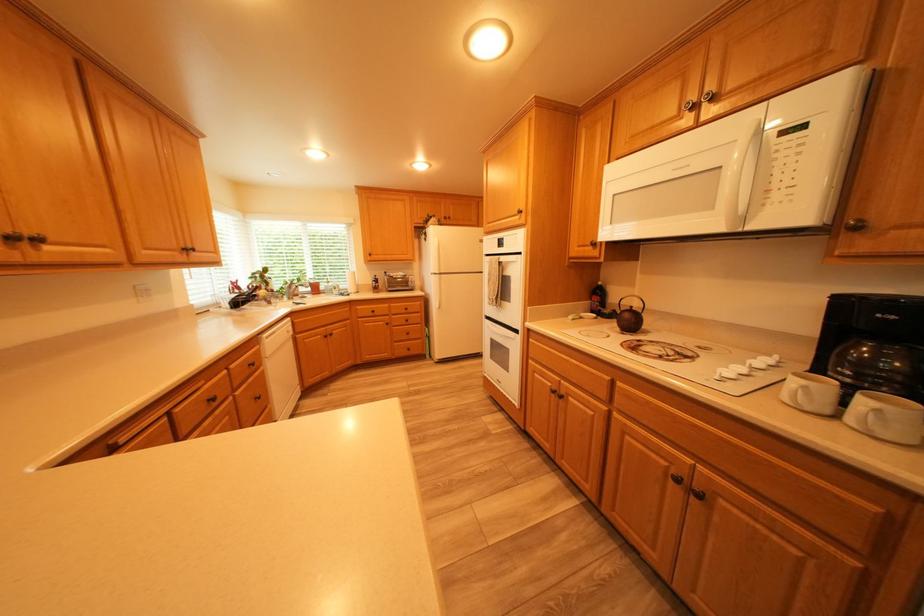
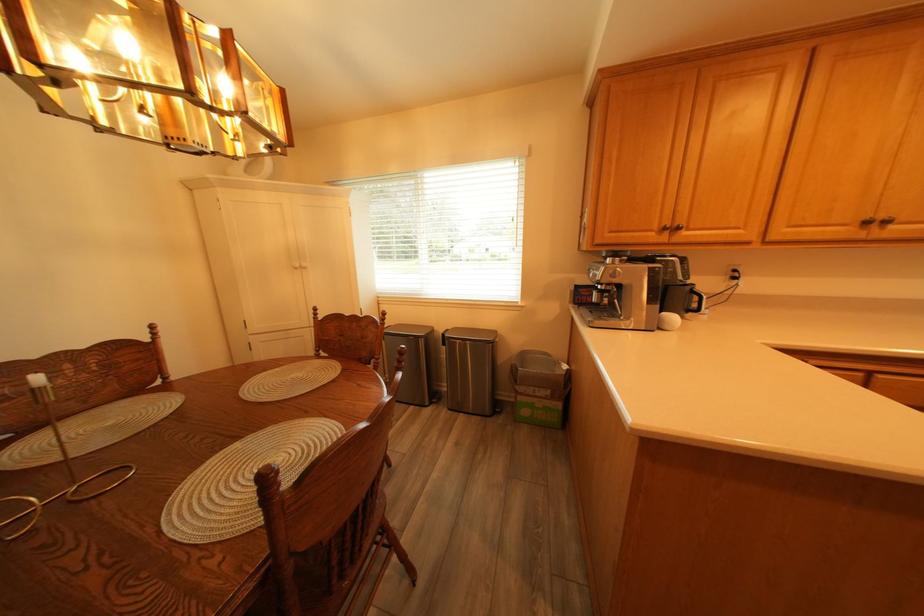
Where in the second image is the point corresponding to point (27, 238) from the first image?

(881, 224)